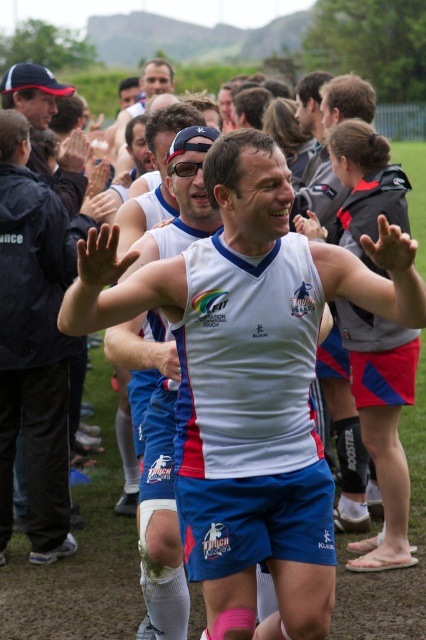
Consider the image. You are a photographer at the rugby touch match. You want to take a photo of the white jersey at center and the matte black jacket at left. According to the scene, which object is positioned lower in the image?

The white jersey at center is positioned lower in the image than the matte black jacket at left.

You are standing at the origin point of the image coordinate system. A white jersey at center is located at point (120, 285). If you move 0.1 units to the right along the x axis, will you be closer to or farther from the white jersey at center?

Moving 0.1 units to the right along the x axis from the origin would take you to point 0.1, 0.0. The white jersey at center is at point (120, 285). The distance between the new position and the white jersey would be sqrt? 0.348 squared plus 0.282 squared, which is approximately sqrt? 0.121 plus 0.0795 equals sqrt? 0.1995, which is about 0.447 units. The original distance from the origin to the white jersey is sqrt? 0.448 squared plus 0.282 squared equals sqrt? 0.1995 plus 0.0795 equals sqrt? 0.279, which?